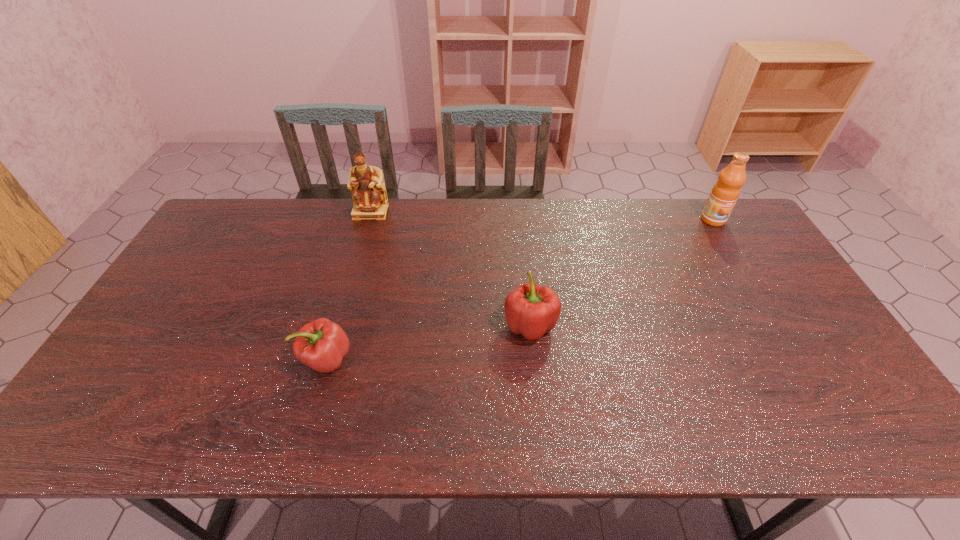
Identify the location of vacant area that lies between the figurine and the right bell pepper. Image resolution: width=960 pixels, height=540 pixels. (450, 268).

This screenshot has height=540, width=960. Identify the location of free space between the rightmost object and the figurine. (541, 215).

This screenshot has height=540, width=960. Find the location of `blank region between the figurine and the fruit juice`. blank region between the figurine and the fruit juice is located at coordinates (541, 215).

At what (x,y) coordinates should I click in order to perform the action: click on object that can be found as the closest to the fruit juice. Please return your answer as a coordinate pair (x, y). The height and width of the screenshot is (540, 960). Looking at the image, I should click on (531, 310).

Identify which object is located as the third nearest to the figurine. Please provide its 2D coordinates. Your answer should be formatted as a tuple, i.e. [(x, y)], where the tuple contains the x and y coordinates of a point satisfying the conditions above.

[(725, 192)]

Locate an element on the screen. free space that satisfies the following two spatial constraints: 1. on the front-facing side of the right bell pepper; 2. on the left side of the figurine is located at coordinates [338, 325].

Locate an element on the screen. free region that satisfies the following two spatial constraints: 1. on the front-facing side of the figurine; 2. on the right side of the second object from right to left is located at coordinates (338, 325).

Locate an element on the screen. This screenshot has width=960, height=540. vacant space that satisfies the following two spatial constraints: 1. on the front-facing side of the third object from left to right; 2. on the right side of the figurine is located at coordinates (338, 325).